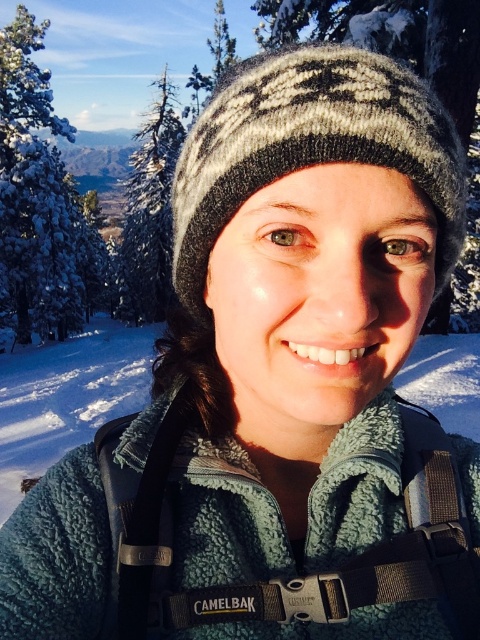
Question: Which point is farther to the camera?

Choices:
 (A) (317, 611)
 (B) (23, 161)
 (C) (227, 209)

Answer: (B)

Question: Which of the following is the closest to the observer?

Choices:
 (A) (83, 282)
 (B) (146, 168)

Answer: (B)

Question: Where is white snow-covered tree at left located in relation to snow-covered branch at upper left in the image?

Choices:
 (A) below
 (B) above

Answer: (B)

Question: Observing the image, what is the correct spatial positioning of white snow-covered tree at left in reference to snow-covered branch at upper left?

Choices:
 (A) above
 (B) below

Answer: (A)

Question: Among these points, which one is farthest from the camera?

Choices:
 (A) (307, 125)
 (B) (147, 236)

Answer: (B)

Question: Can you confirm if black nylon strap at center is wider than white snow-covered tree at left?

Choices:
 (A) yes
 (B) no

Answer: (B)